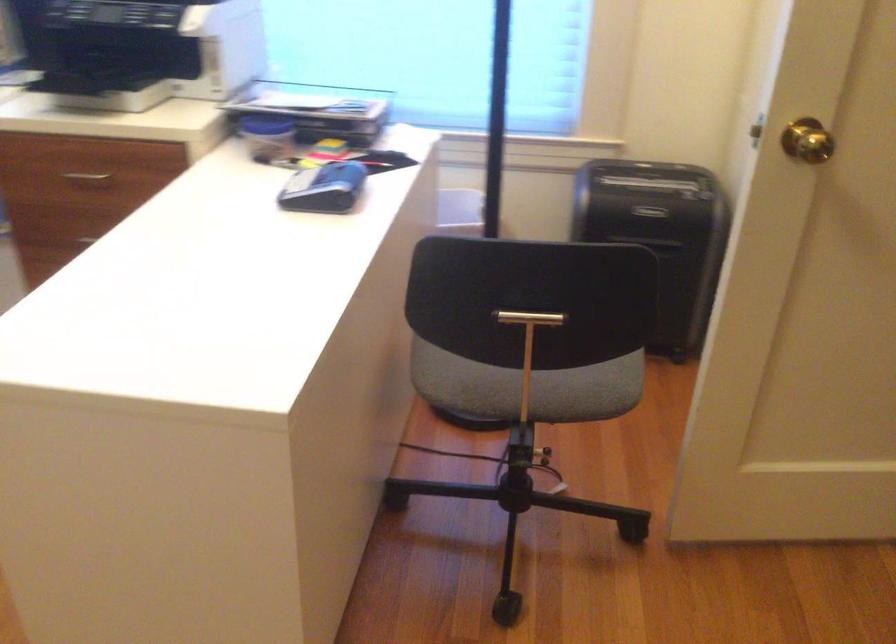
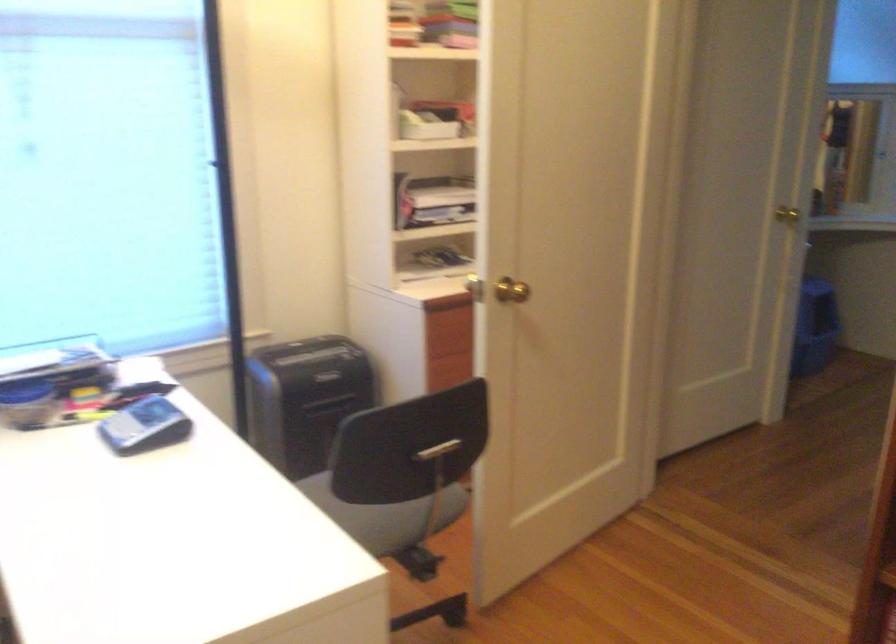
Question: Based on the continuous images, in which direction is the camera rotating? Reply with the corresponding letter.

Choices:
 (A) Left
 (B) Right
 (C) Up
 (D) Down

Answer: (B)